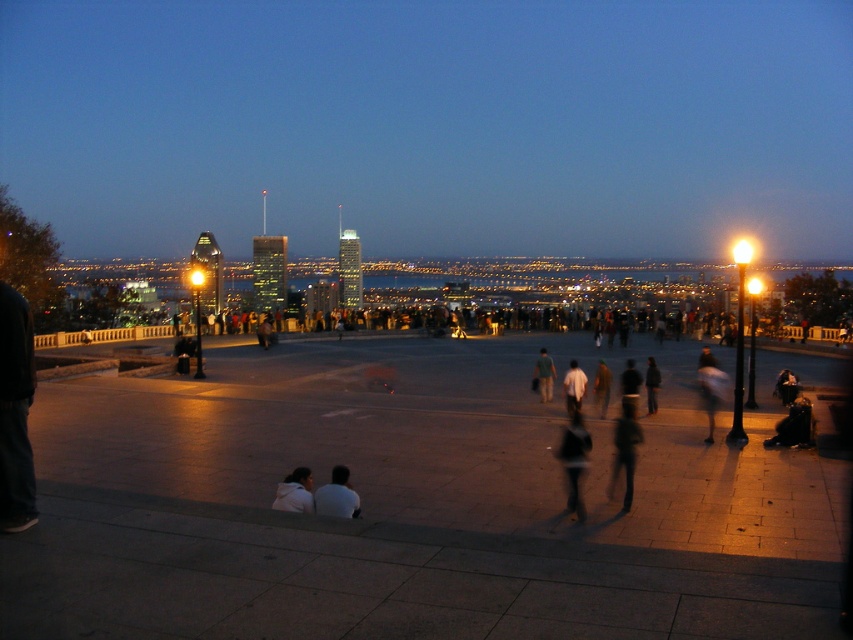
Question: Which is nearer to the white matte shirt at center?

Choices:
 (A) white cotton shirt at lower center
 (B) light blue jeans at center
 (C) dark gray jacket at center

Answer: (B)

Question: Does dark green fabric jacket at center lie behind dark gray jacket at center?

Choices:
 (A) no
 (B) yes

Answer: (A)

Question: Is dark green fabric jacket at center to the left of white cotton shirt at lower center from the viewer's perspective?

Choices:
 (A) yes
 (B) no

Answer: (B)

Question: Which point appears farthest from the camera in this image?

Choices:
 (A) (581, 396)
 (B) (653, 406)
 (C) (306, 493)

Answer: (B)

Question: Among these points, which one is nearest to the camera?

Choices:
 (A) (718, 394)
 (B) (579, 445)
 (C) (547, 355)
 (D) (656, 387)

Answer: (B)

Question: Does dark green fabric jacket at center have a larger size compared to light blue jeans at center?

Choices:
 (A) no
 (B) yes

Answer: (A)